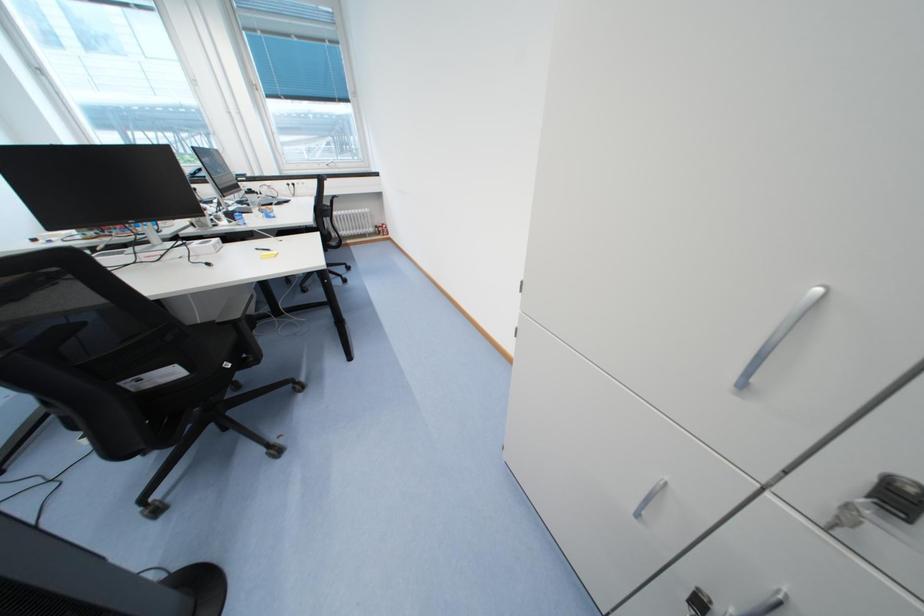
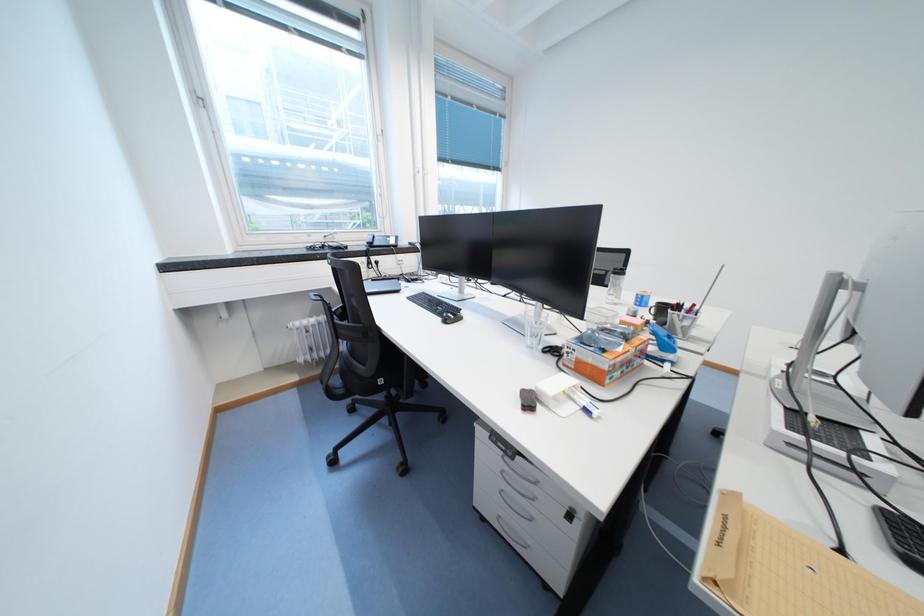
Question: What movement of the cameraman would produce the second image?

Choices:
 (A) Left
 (B) Right
 (C) Forward
 (D) Backward

Answer: (A)